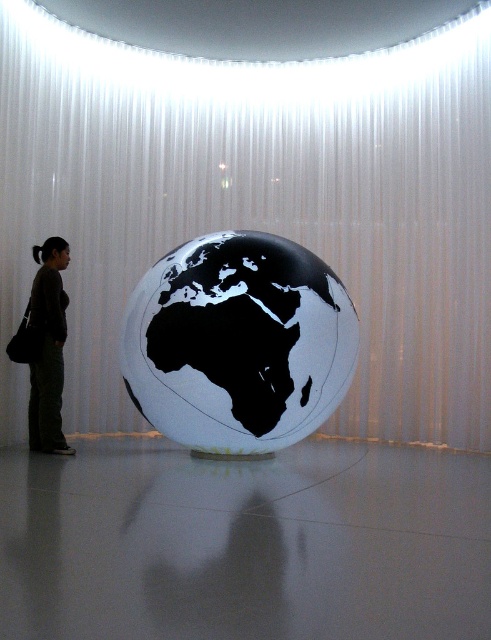
Between white sheer curtain at center and brown fabric pants at left, which one appears on the left side from the viewer's perspective?

brown fabric pants at left

Which is in front, point (225, 80) or point (54, 358)?

Point (54, 358)

Where is `white sheer curtain at center`? This screenshot has width=491, height=640. white sheer curtain at center is located at coordinates (257, 204).

Who is shorter, white glossy globe at center or brown fabric pants at left?

white glossy globe at center is shorter.

In the scene shown: How distant is white glossy globe at center from brown fabric pants at left?

A distance of 1.58 meters exists between white glossy globe at center and brown fabric pants at left.

Locate an element on the screen. white glossy globe at center is located at coordinates (239, 342).

I want to click on white glossy globe at center, so pos(239,342).

Describe the element at coordinates (257, 204) in the screenshot. I see `white sheer curtain at center` at that location.

Does white sheer curtain at center lie behind white glossy globe at center?

Yes, it is.

Find the location of a particular element. The height and width of the screenshot is (640, 491). white sheer curtain at center is located at coordinates (257, 204).

Identify the location of white sheer curtain at center. This screenshot has width=491, height=640. (257, 204).